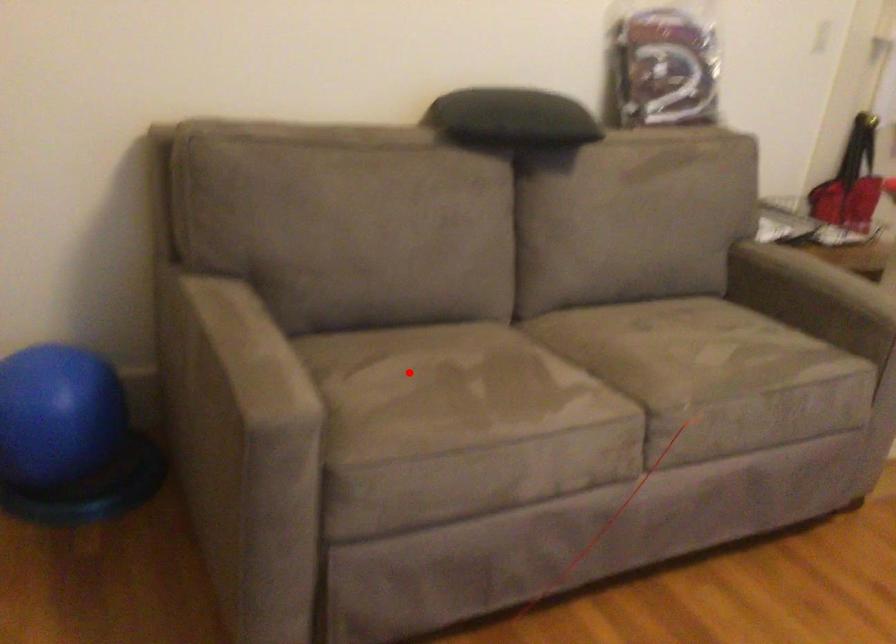
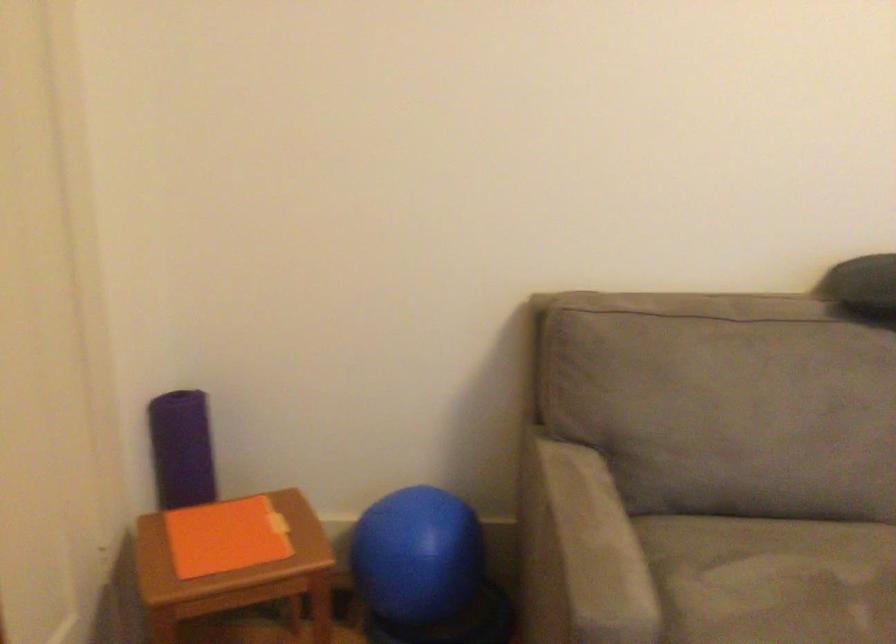
In the second image, find the point that corresponds to the highlighted location in the first image.

(771, 579)